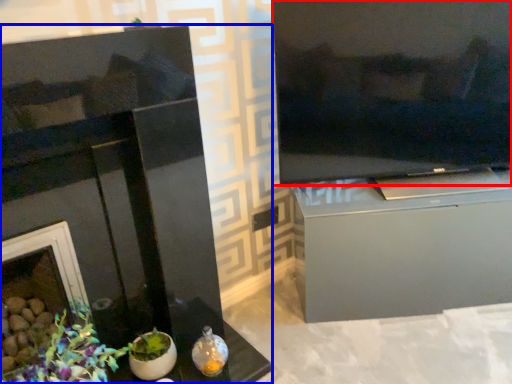
Question: Which of the following is the farthest to the observer, television (highlighted by a red box) or fireplace (highlighted by a blue box)?

Choices:
 (A) television
 (B) fireplace

Answer: (A)